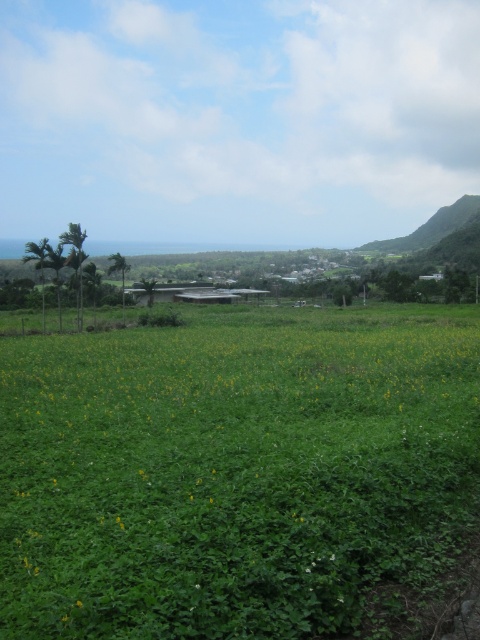
You are a gardener planning to plant new flowers in the green grassy field at center and the yellow matte flower at center. Which area requires more space for planting?

The green grassy field at center requires more space for planting because it is larger in size than the yellow matte flower at center.

You are a gardener who wants to plant a new tree in the green grassy field at center. The tree requires a space of 50 feet in diameter to grow properly. Considering the yellow matte flower at center is already present, will there be enough space between them for the tree to grow without affecting the flower?

The distance between the green grassy field at center and the yellow matte flower at center is 56.33 feet, which is greater than the required 50 feet diameter. Therefore, there is sufficient space to plant the tree without affecting the flower.